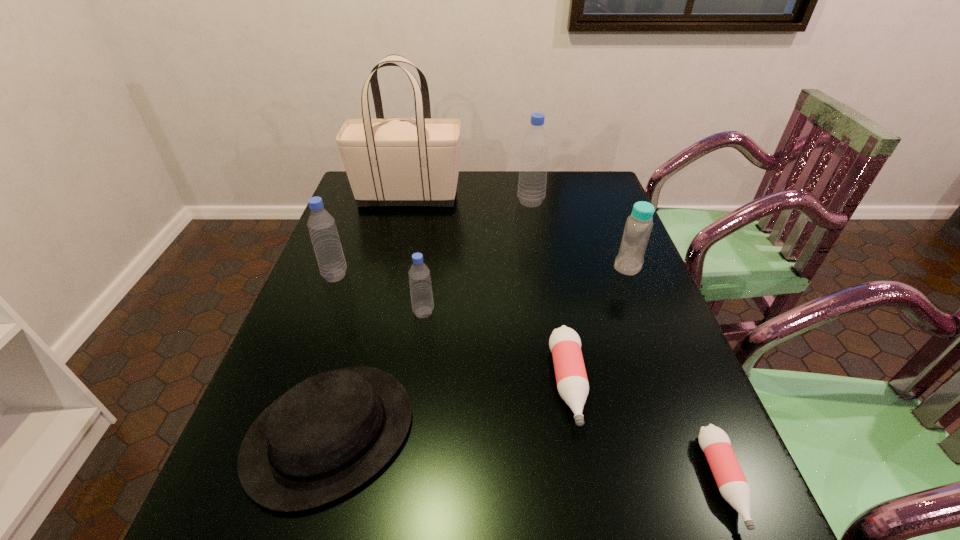
At what (x,y) coordinates should I click in order to perform the action: click on the third shortest object. Please return your answer as a coordinate pair (x, y). Looking at the image, I should click on (326, 436).

The image size is (960, 540). What are the coordinates of `the left pink bottle` in the screenshot? It's located at (572, 383).

At what (x,y) coordinates should I click in order to perform the action: click on the bigger pink bottle. Please return your answer as a coordinate pair (x, y). Image resolution: width=960 pixels, height=540 pixels. Looking at the image, I should click on (572, 383).

The height and width of the screenshot is (540, 960). I want to click on the right pink bottle, so click(714, 442).

Identify the location of the shortest bottle. The width and height of the screenshot is (960, 540). (714, 442).

Image resolution: width=960 pixels, height=540 pixels. I want to click on free spot located with handles facing forward on the gray shopping bag, so click(x=509, y=197).

Identify the location of vacant area situated on the front of the farthest blue bottle. Image resolution: width=960 pixels, height=540 pixels. (534, 219).

The width and height of the screenshot is (960, 540). I want to click on blank space located 0.060m on the back of the leftmost bottle, so click(x=344, y=253).

The width and height of the screenshot is (960, 540). I want to click on vacant region located on the front of the rightmost blue bottle, so coord(672,377).

You are a GUI agent. You are given a task and a screenshot of the screen. Output one action in this format:
    pyautogui.click(x=<x>, y=<y>)
    Task: Click on the free space located on the front of the nearest blue bottle
    This screenshot has width=960, height=540.
    Given the screenshot: What is the action you would take?
    [x=420, y=339]